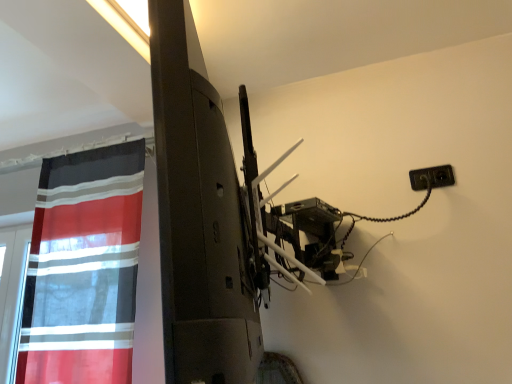
At what (x,y) coordinates should I click in order to perform the action: click on black plastic outlet at upper right. Please return your answer as a coordinate pair (x, y). This screenshot has width=512, height=384. Looking at the image, I should click on (432, 177).

Measure the distance between black plastic outlet at upper right and camera.

They are 5.33 feet apart.

Describe the element at coordinates (432, 177) in the screenshot. I see `black plastic outlet at upper right` at that location.

The width and height of the screenshot is (512, 384). What do you see at coordinates (83, 268) in the screenshot?
I see `red sheer curtain at left` at bounding box center [83, 268].

This screenshot has width=512, height=384. Find the location of `red sheer curtain at left`. red sheer curtain at left is located at coordinates (83, 268).

In order to face red sheer curtain at left, should I rotate leftwards or rightwards?

Rotate left and turn 21.129 degrees.

This screenshot has height=384, width=512. I want to click on black plastic outlet at upper right, so click(432, 177).

Which is more to the right, black plastic outlet at upper right or red sheer curtain at left?

black plastic outlet at upper right is more to the right.

Which object is more forward, black plastic outlet at upper right or red sheer curtain at left?

Positioned in front is red sheer curtain at left.

Does point (445, 174) come farther from viewer compared to point (73, 247)?

That is False.

From the image's perspective, relative to red sheer curtain at left, is black plastic outlet at upper right above or below?

black plastic outlet at upper right is above red sheer curtain at left.

From a real-world perspective, does black plastic outlet at upper right sit lower than red sheer curtain at left?

No, from a real-world perspective, black plastic outlet at upper right is not below red sheer curtain at left.

Considering the relative sizes of black plastic outlet at upper right and red sheer curtain at left in the image provided, is black plastic outlet at upper right wider than red sheer curtain at left?

Incorrect, the width of black plastic outlet at upper right does not surpass that of red sheer curtain at left.

Between black plastic outlet at upper right and red sheer curtain at left, which one has less height?

With less height is black plastic outlet at upper right.

Which of these two, black plastic outlet at upper right or red sheer curtain at left, is smaller?

black plastic outlet at upper right.

Is red sheer curtain at left completely or partially inside black plastic outlet at upper right?

No, red sheer curtain at left is not surrounded by black plastic outlet at upper right.

Is black plastic outlet at upper right placed right next to red sheer curtain at left?

No, black plastic outlet at upper right is not touching red sheer curtain at left.

Could you tell me if black plastic outlet at upper right is turned towards red sheer curtain at left?

No, black plastic outlet at upper right is not turned towards red sheer curtain at left.

Can you tell me how much black plastic outlet at upper right and red sheer curtain at left differ in facing direction?

black plastic outlet at upper right and red sheer curtain at left are facing 1.81 degrees away from each other.

You are a GUI agent. You are given a task and a screenshot of the screen. Output one action in this format:
    pyautogui.click(x=<x>, y=<y>)
    Task: Click on the curtain that appears below the black plastic outlet at upper right (from the image's perspective)
    
    Given the screenshot: What is the action you would take?
    pyautogui.click(x=83, y=268)

Can you confirm if red sheer curtain at left is positioned to the right of black plastic outlet at upper right?

No.

Is red sheer curtain at left positioned before black plastic outlet at upper right?

Yes, the depth of red sheer curtain at left is less than that of black plastic outlet at upper right.

Is point (47, 290) closer to viewer compared to point (417, 187)?

No, it is not.

From the image's perspective, which is below, red sheer curtain at left or black plastic outlet at upper right?

From the image's view, red sheer curtain at left is below.

From a real-world perspective, which is physically above, red sheer curtain at left or black plastic outlet at upper right?

In real-world perspective, black plastic outlet at upper right is above.

Considering the relative sizes of red sheer curtain at left and black plastic outlet at upper right in the image provided, is red sheer curtain at left thinner than black plastic outlet at upper right?

No.

Is red sheer curtain at left shorter than black plastic outlet at upper right?

No.

Is red sheer curtain at left bigger than black plastic outlet at upper right?

Correct, red sheer curtain at left is larger in size than black plastic outlet at upper right.

Based on the photo, would you say black plastic outlet at upper right is part of red sheer curtain at left's contents?

No, black plastic outlet at upper right is not surrounded by red sheer curtain at left.

Is the surface of red sheer curtain at left in direct contact with black plastic outlet at upper right?

No, red sheer curtain at left is not next to black plastic outlet at upper right.

Is red sheer curtain at left looking in the opposite direction of black plastic outlet at upper right?

No.

Based on the photo, how different are the orientations of red sheer curtain at left and black plastic outlet at upper right in degrees?

red sheer curtain at left and black plastic outlet at upper right are facing 1.81 degrees away from each other.

Identify the location of curtain beneath the black plastic outlet at upper right (from a real-world perspective). The height and width of the screenshot is (384, 512). (83, 268).

Locate an element on the screen. This screenshot has height=384, width=512. electric outlet behind the red sheer curtain at left is located at coordinates (432, 177).

In the image, there is a black plastic outlet at upper right. Where is `curtain below it (from a real-world perspective)`? Image resolution: width=512 pixels, height=384 pixels. curtain below it (from a real-world perspective) is located at coordinates (83, 268).